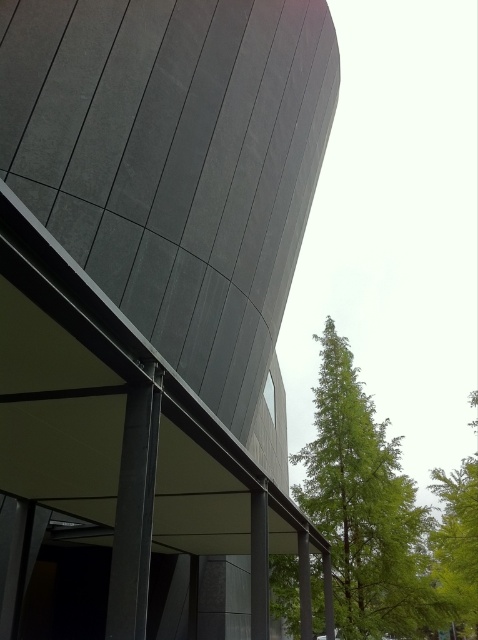
Consider the image. You are standing in front of the matte gray building at center and want to take a photo of the green leafy tree at upper right. Which direction should you face to ensure the tree is in the frame?

The matte gray building at center is positioned on the left side of green leafy tree at upper right, so you should face towards the right to include the tree in your photo.

You are standing 50 feet away from a modern building with dark gray panels. There is a point labeled as point (358, 550) on the building. If you want to reach that point by walking straight towards it, will you be able to touch it before reaching the building?

The distance of point (358, 550) from viewer is 46.22 feet. Since you are initially 50 feet away from the building, you will reach the building before touching the point as the point is closer than your initial distance.

You are an architect evaluating the proportions of the matte gray building at center and the green leafy tree at upper right. Which structure is taller?

The matte gray building at center is taller than the green leafy tree at upper right according to the description.